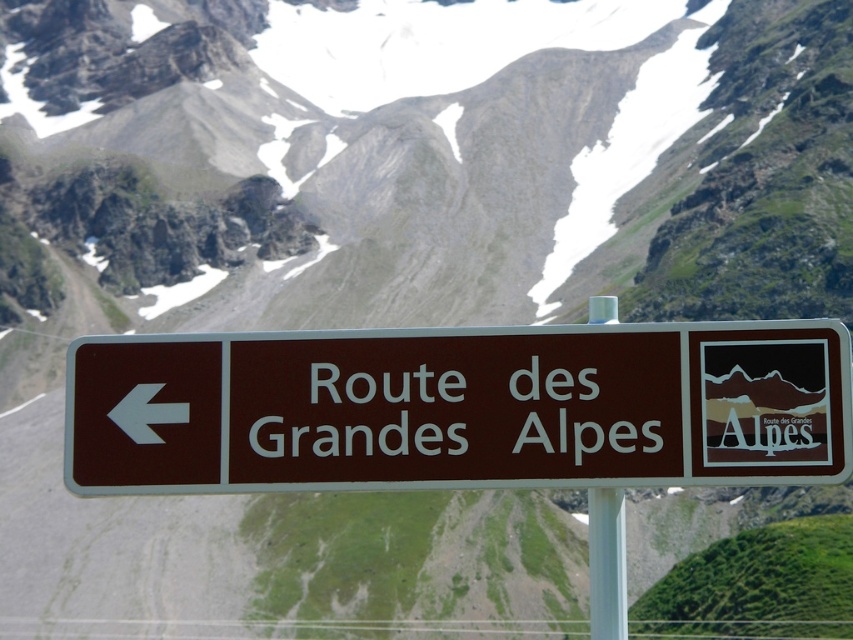
Can you confirm if brown plastic sign at center is wider than white plastic pole at center?

Correct, the width of brown plastic sign at center exceeds that of white plastic pole at center.

Can you confirm if brown plastic sign at center is shorter than white plastic pole at center?

Yes.

Who is more distant from viewer, (583, 362) or (625, 580)?

Positioned behind is point (625, 580).

Find the location of `brown plastic sign at center`. brown plastic sign at center is located at coordinates (460, 408).